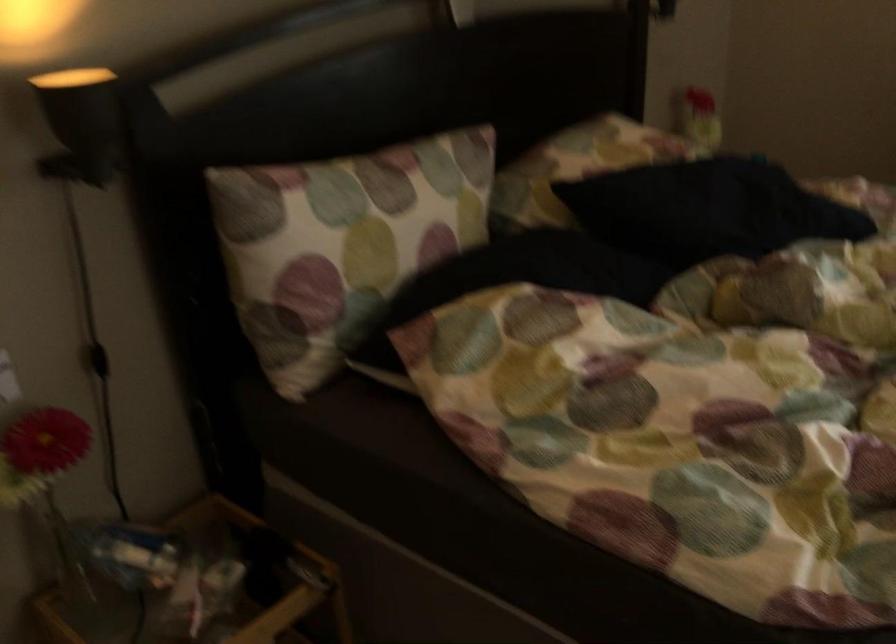
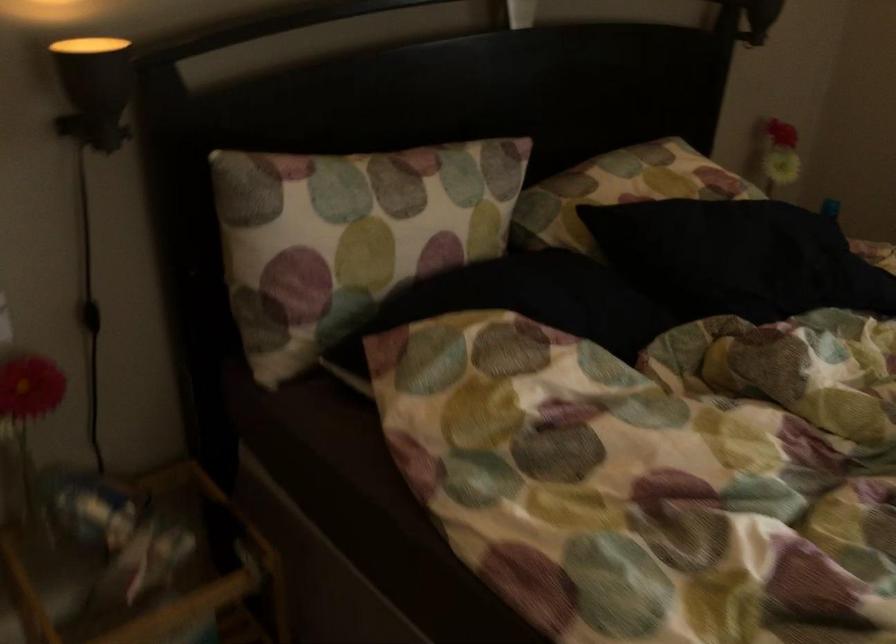
The point at (x=71, y=77) is marked in the first image. Where is the corresponding point in the second image?

(90, 48)